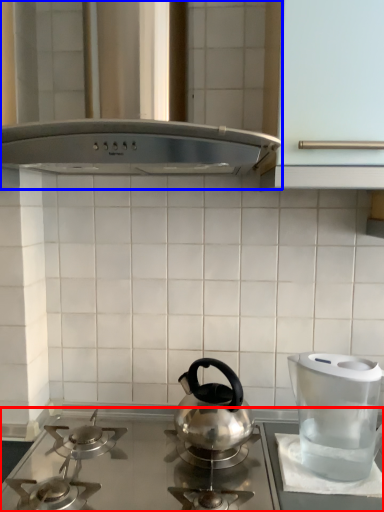
Question: Which point is further to the camera, gas stove (highlighted by a red box) or vent (highlighted by a blue box)?

Choices:
 (A) gas stove
 (B) vent

Answer: (A)